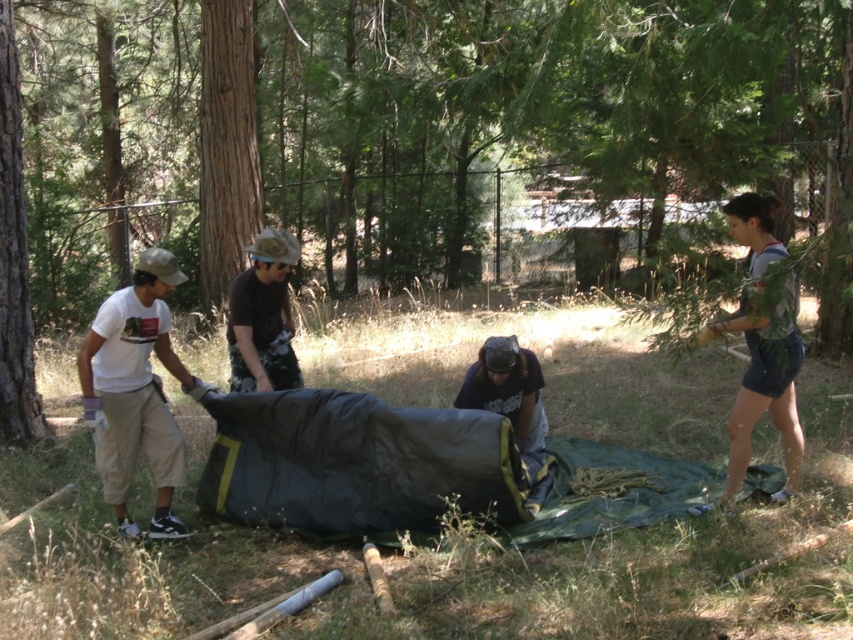
You are standing at the center of the image and want to move towards the gray cotton shorts at right. Which direction should you move in?

Since the gray cotton shorts at right is located at point 0.550 on the x axis and 0.893 on the y axis, you should move towards the right and downward to reach it.